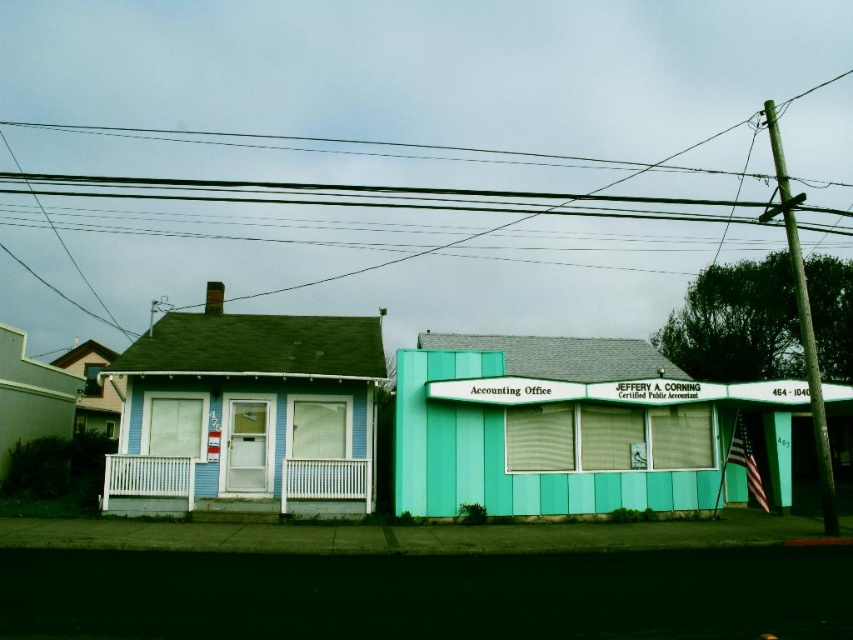
Question: In this image, where is teal paneling at center located relative to black wire at upper center?

Choices:
 (A) below
 (B) above

Answer: (A)

Question: Among these objects, which one is nearest to the camera?

Choices:
 (A) black wire at upper center
 (B) teal paneling at center

Answer: (A)

Question: Among these objects, which one is farthest from the camera?

Choices:
 (A) teal paneling at center
 (B) black wire at upper center

Answer: (A)

Question: Observing the image, what is the correct spatial positioning of teal paneling at center in reference to black wire at upper center?

Choices:
 (A) below
 (B) above

Answer: (A)

Question: Is teal paneling at center above black wire at upper center?

Choices:
 (A) yes
 (B) no

Answer: (B)